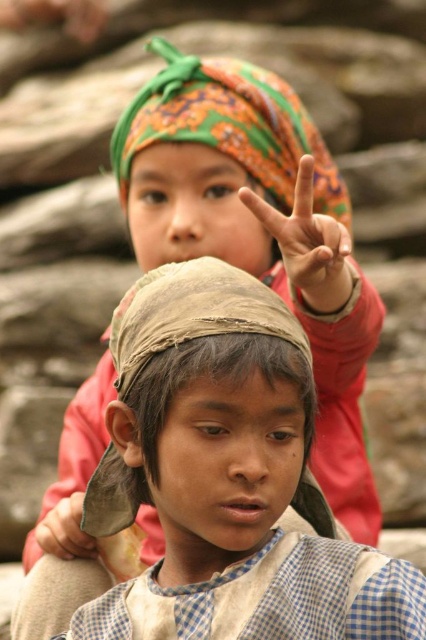
Is brown textured cloth at center shorter than matte fabric hand at upper center?

In fact, brown textured cloth at center may be taller than matte fabric hand at upper center.

Which of these two, brown textured cloth at center or matte fabric hand at upper center, stands taller?

brown textured cloth at center

Between point (115, 605) and point (351, 288), which one is positioned in front?

Point (115, 605) is more forward.

The height and width of the screenshot is (640, 426). I want to click on brown textured cloth at center, so click(x=227, y=476).

Is matte fabric hand at upper center wider than matte brown hand at center?

Yes.

Between matte fabric hand at upper center and matte brown hand at center, which one appears on the right side from the viewer's perspective?

Positioned to the right is matte fabric hand at upper center.

Is point (340, 301) closer to viewer compared to point (40, 545)?

No, (340, 301) is behind (40, 545).

Image resolution: width=426 pixels, height=640 pixels. I want to click on matte fabric hand at upper center, so click(307, 243).

What do you see at coordinates (230, 125) in the screenshot? I see `printed fabric headscarf at upper center` at bounding box center [230, 125].

Consider the image. Does printed fabric headscarf at upper center appear on the left side of matte fabric hand at upper center?

Indeed, printed fabric headscarf at upper center is positioned on the left side of matte fabric hand at upper center.

Who is more distant from viewer, (224, 84) or (287, 230)?

Point (224, 84)

Find the location of a particular element. printed fabric headscarf at upper center is located at coordinates (230, 125).